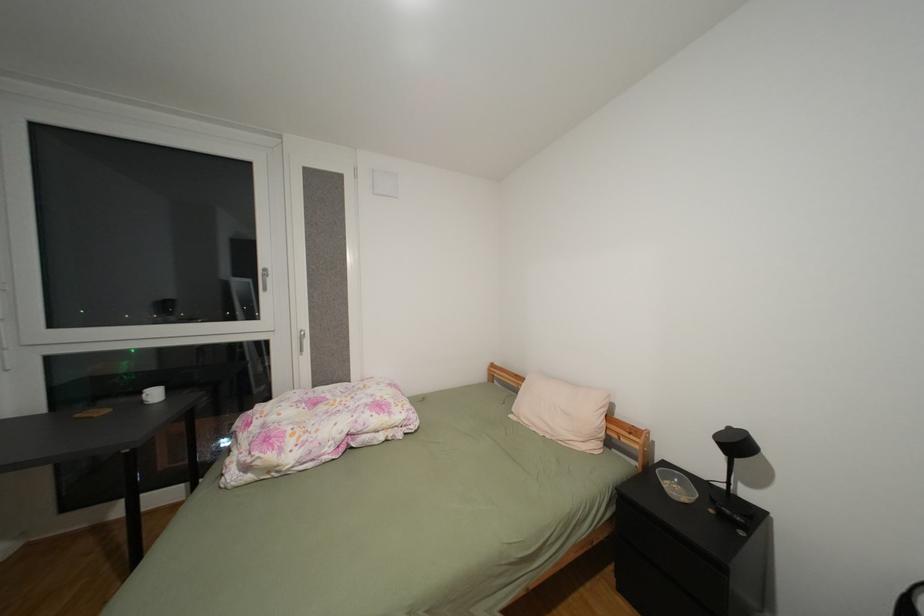
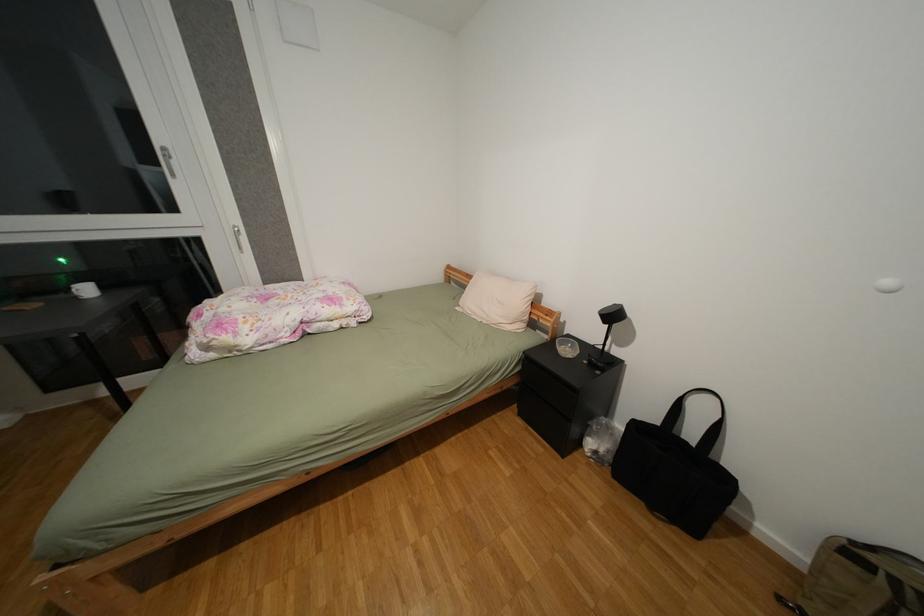
In a continuous first-person perspective shot, in which direction is the camera moving?

The movement direction of the cameraman is right, backward.